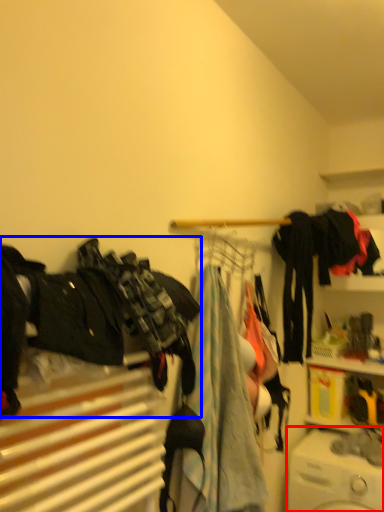
Question: Which point is further to the camera, washing machine (highlighted by a red box) or clothing (highlighted by a blue box)?

Choices:
 (A) washing machine
 (B) clothing

Answer: (A)